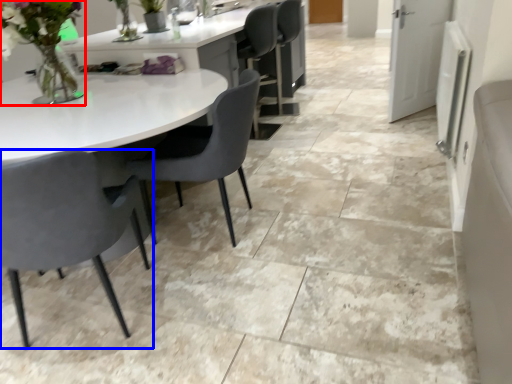
Question: Which of the following is the farthest to the observer, floral arrangement (highlighted by a red box) or chair (highlighted by a blue box)?

Choices:
 (A) floral arrangement
 (B) chair

Answer: (A)